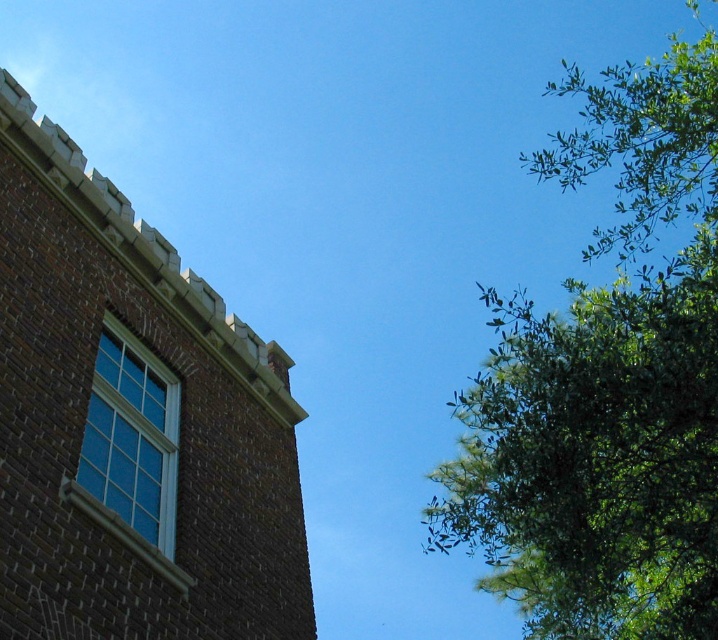
Does brown brick tower at upper left appear on the left side of matte glass window at upper left?

Yes, brown brick tower at upper left is to the left of matte glass window at upper left.

Locate an element on the screen. Image resolution: width=718 pixels, height=640 pixels. brown brick tower at upper left is located at coordinates click(131, 422).

This screenshot has width=718, height=640. I want to click on brown brick tower at upper left, so click(x=131, y=422).

Who is more distant from viewer, [51,227] or [595,509]?

Point [51,227]

You are a GUI agent. You are given a task and a screenshot of the screen. Output one action in this format:
    pyautogui.click(x=<x>, y=<y>)
    Task: Click on the brown brick tower at upper left
    
    Given the screenshot: What is the action you would take?
    coord(131,422)

Locate an element on the screen. The width and height of the screenshot is (718, 640). brown brick tower at upper left is located at coordinates (131, 422).

Measure the distance between point (615, 152) and camera.

125.23 meters

Identify the location of green leafy tree at upper right. The height and width of the screenshot is (640, 718). (607, 387).